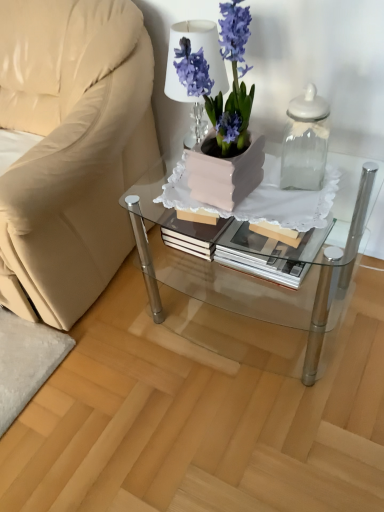
Identify the location of vacant space in clear glass coffee table at center (from a real-world perspective). (266, 315).